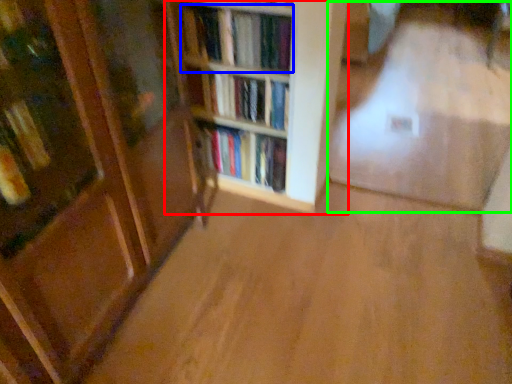
Question: Considering the real-world distances, which object is farthest from shelf (highlighted by a red box)? book (highlighted by a blue box) or corridor (highlighted by a green box)?

Choices:
 (A) book
 (B) corridor

Answer: (B)